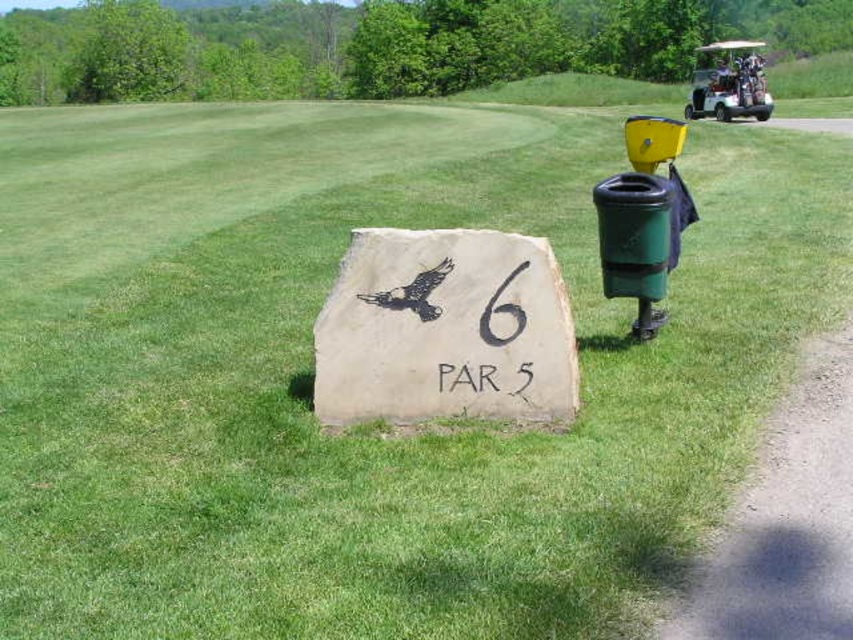
Question: Which of the following is the farthest from the observer?

Choices:
 (A) click(x=477, y=236)
 (B) click(x=717, y=84)

Answer: (B)

Question: Is natural stone sign at center positioned behind metallic silver golf cart at upper right?

Choices:
 (A) yes
 (B) no

Answer: (B)

Question: Does natural stone sign at center appear on the right side of metallic silver golf cart at upper right?

Choices:
 (A) no
 (B) yes

Answer: (A)

Question: Does natural stone sign at center have a smaller size compared to metallic silver golf cart at upper right?

Choices:
 (A) no
 (B) yes

Answer: (B)